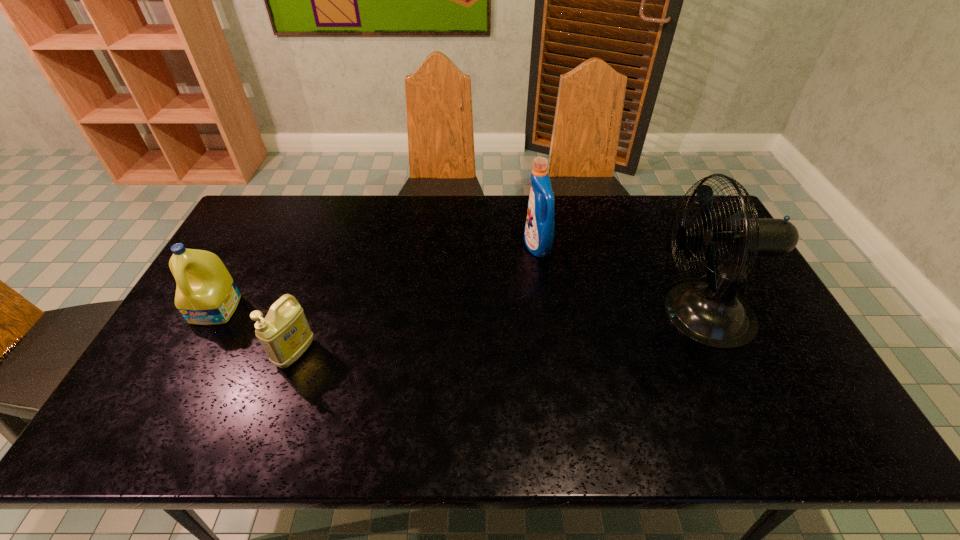
At what (x,y) coordinates should I click in order to perform the action: click on vacant region at the near edge. Please return your answer as a coordinate pair (x, y). The image size is (960, 540). Looking at the image, I should click on (243, 413).

In the image, there is a desktop. Where is `vacant space at the left edge`? This screenshot has height=540, width=960. vacant space at the left edge is located at coordinates pos(268,244).

Identify the location of vacant area at the far left corner of the desktop. [281, 230].

What are the coordinates of `free space that is in between the leftmost object and the tallest object` in the screenshot? It's located at (459, 312).

Image resolution: width=960 pixels, height=540 pixels. Identify the location of free space between the shortest object and the third shortest object. (417, 300).

You are a GUI agent. You are given a task and a screenshot of the screen. Output one action in this format:
    pyautogui.click(x=<x>, y=<y>)
    Task: Click on the unoccupied area between the third shortest object and the shortest object
    Image resolution: width=960 pixels, height=540 pixels.
    Given the screenshot: What is the action you would take?
    pyautogui.click(x=417, y=300)

The width and height of the screenshot is (960, 540). Find the location of `vacant area between the tallest object and the third shortest object`. vacant area between the tallest object and the third shortest object is located at coordinates (619, 280).

Locate an element on the screen. free space between the rightmost object and the rightmost detergent is located at coordinates (619, 280).

I want to click on vacant area that lies between the third object from right to left and the farthest object, so click(x=417, y=300).

Where is `free space between the farthest object and the leftmost object`? The width and height of the screenshot is (960, 540). free space between the farthest object and the leftmost object is located at coordinates (377, 278).